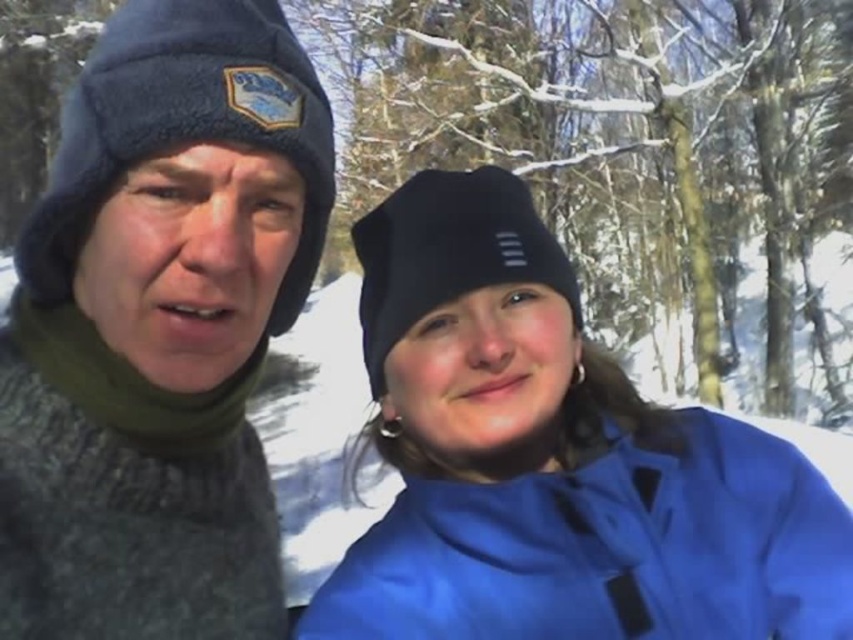
What is the exact location of the knitted wool sweater at left in the image?

The knitted wool sweater at left is located at point (160, 328).

You are taking a photo of two people standing in a snowy area. The first person is at point [80,518] and the second person is at point [547,422]. From your camera position, which person is closer to the camera?

The person at point [80,518] is closer to the camera because point [80,518] is in front of point [547,422].